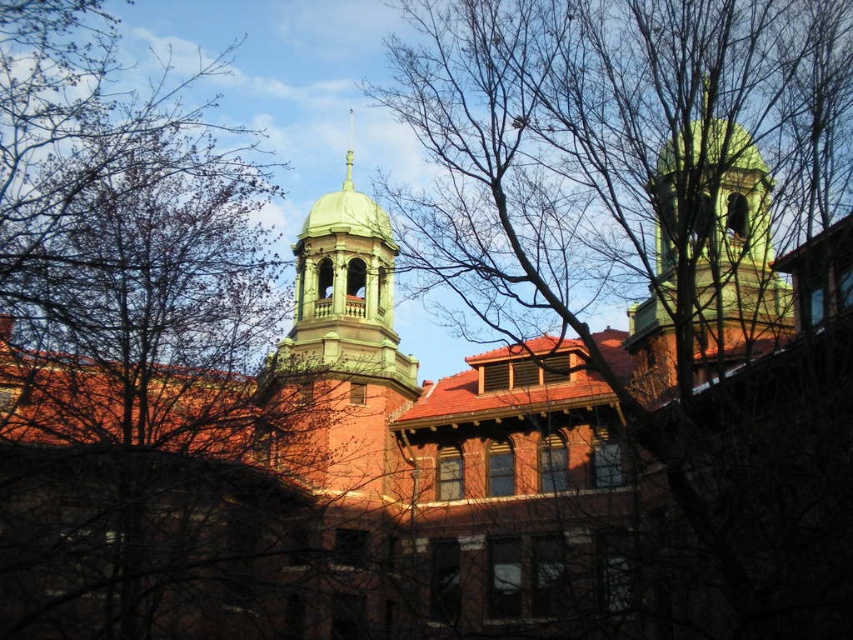
You are standing in front of the historic building and notice the bare branches at upper left. Can you determine their exact position relative to the building?

The bare branches at upper left are positioned at coordinates point (x=175, y=369), which places them near the upper left area of the image, framing the view of the building.

You are standing in front of the historic building and notice two points marked on the image. Which of the two points, point (412,29) or point (345,156), is closer to you?

Point (412,29) is closer to the viewer than point (345,156).

You are standing in front of the historic building and notice the bare branches at upper center and the green polished spire at upper center. Which one is closer to the ground?

The bare branches at upper center is below the green polished spire at upper center, so the bare branches at upper center is closer to the ground.